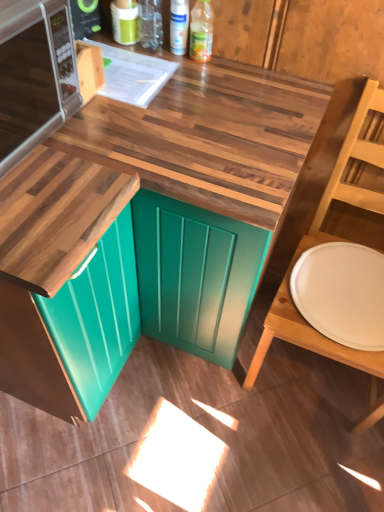
Find the location of a particular element. This screenshot has width=384, height=512. free point above teal glossy cabinet at lower left (from a real-world perspective) is located at coordinates (39, 178).